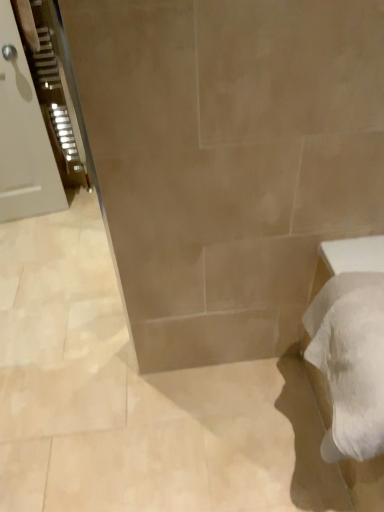
Question: In the image, is matte white door at left on the left side or the right side of white fluffy bath towel at lower right?

Choices:
 (A) left
 (B) right

Answer: (A)

Question: In terms of width, does matte white door at left look wider or thinner when compared to white fluffy bath towel at lower right?

Choices:
 (A) thin
 (B) wide

Answer: (A)

Question: In terms of height, does matte white door at left look taller or shorter compared to white fluffy bath towel at lower right?

Choices:
 (A) tall
 (B) short

Answer: (A)

Question: In the image, is white fluffy bath towel at lower right positioned in front of or behind matte white door at left?

Choices:
 (A) behind
 (B) front

Answer: (B)

Question: From a real-world perspective, is white fluffy bath towel at lower right physically located above or below matte white door at left?

Choices:
 (A) below
 (B) above

Answer: (A)

Question: In the image, is white fluffy bath towel at lower right on the left side or the right side of matte white door at left?

Choices:
 (A) right
 (B) left

Answer: (A)

Question: Considering the positions of point (332, 316) and point (6, 74), is point (332, 316) closer or farther from the camera than point (6, 74)?

Choices:
 (A) closer
 (B) farther

Answer: (A)